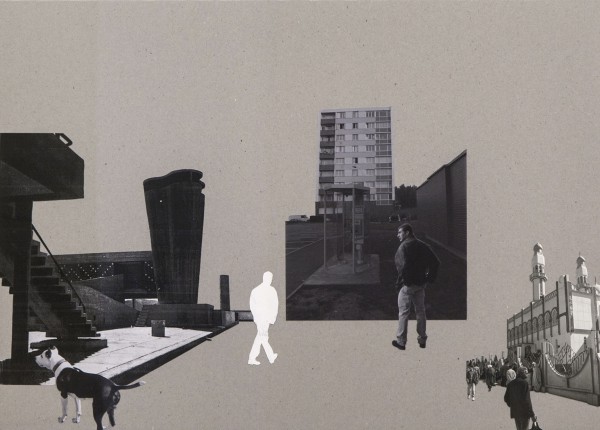
Find the location of a particular element. Image resolution: width=600 pixels, height=430 pixels. rubbish bin is located at coordinates (155, 327).